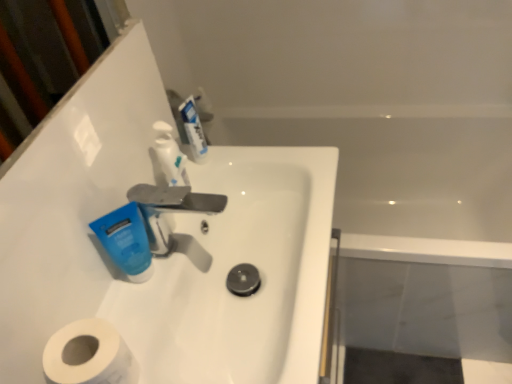
I want to click on free space in front of blue matte tube at center-left, the second mouthwash from the right, so click(143, 320).